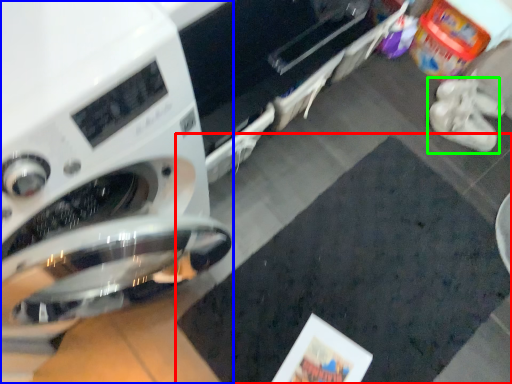
Question: Based on their relative distances, which object is nearer to mat (highlighted by a red box)? Choose from washing machine (highlighted by a blue box) and footwear (highlighted by a green box).

Choices:
 (A) washing machine
 (B) footwear

Answer: (B)